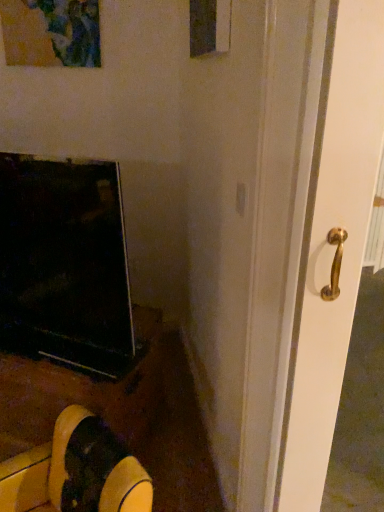
Image resolution: width=384 pixels, height=512 pixels. Describe the element at coordinates (51, 32) in the screenshot. I see `matte glass picture frame at upper left` at that location.

Measure the distance between point (59,10) and camera.

5.94 feet.

Identify the location of matte glass picture frame at upper left. (51, 32).

This screenshot has width=384, height=512. Identify the location of matte glass picture frame at upper left. (51, 32).